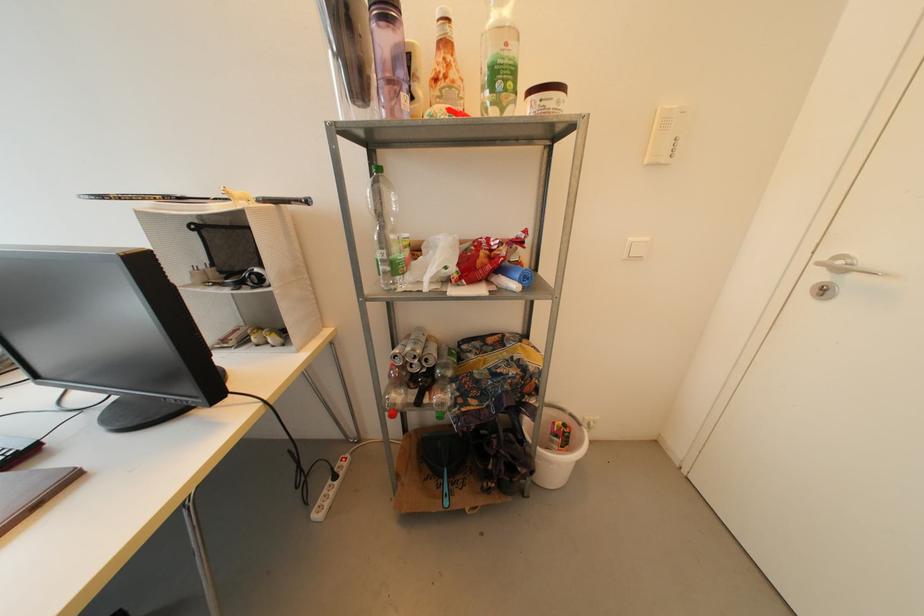
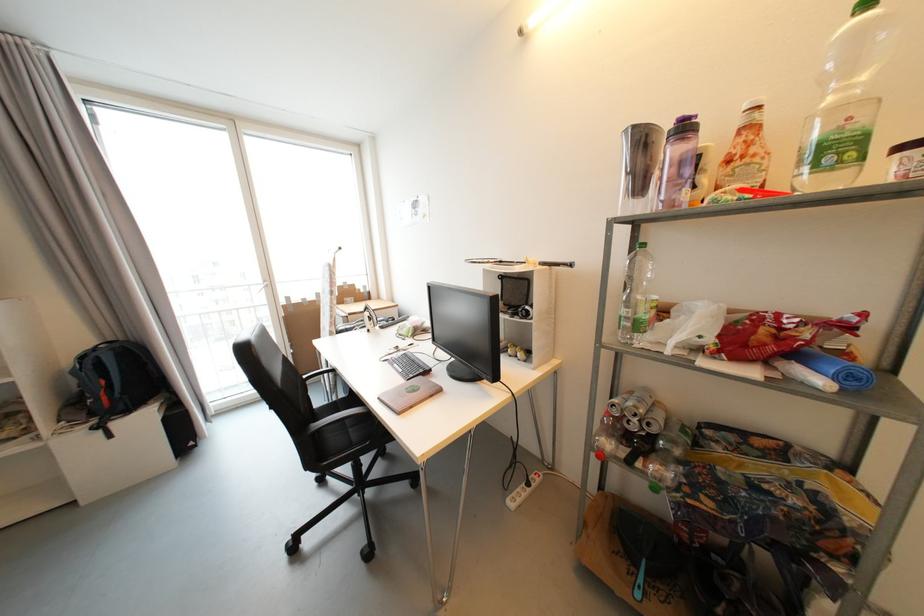
Locate, in the second image, the point that corresponds to [420,371] in the first image.

(638, 430)